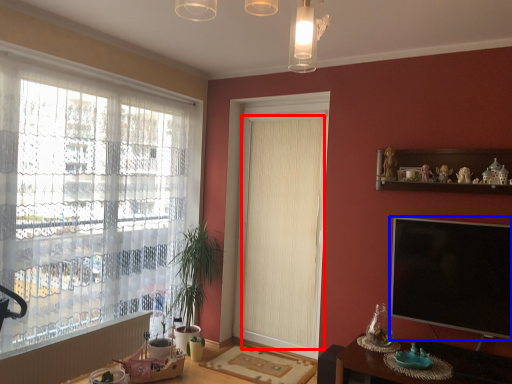
Question: Which object is closer to the camera taking this photo, curtain (highlighted by a red box) or television (highlighted by a blue box)?

Choices:
 (A) curtain
 (B) television

Answer: (B)